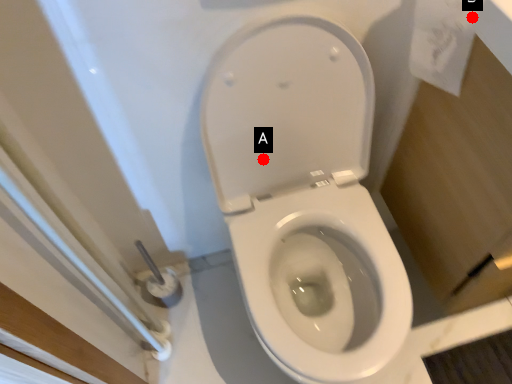
Question: Two points are circled on the image, labeled by A and B beside each circle. Which point is closer to the camera?

Choices:
 (A) A is closer
 (B) B is closer

Answer: (B)